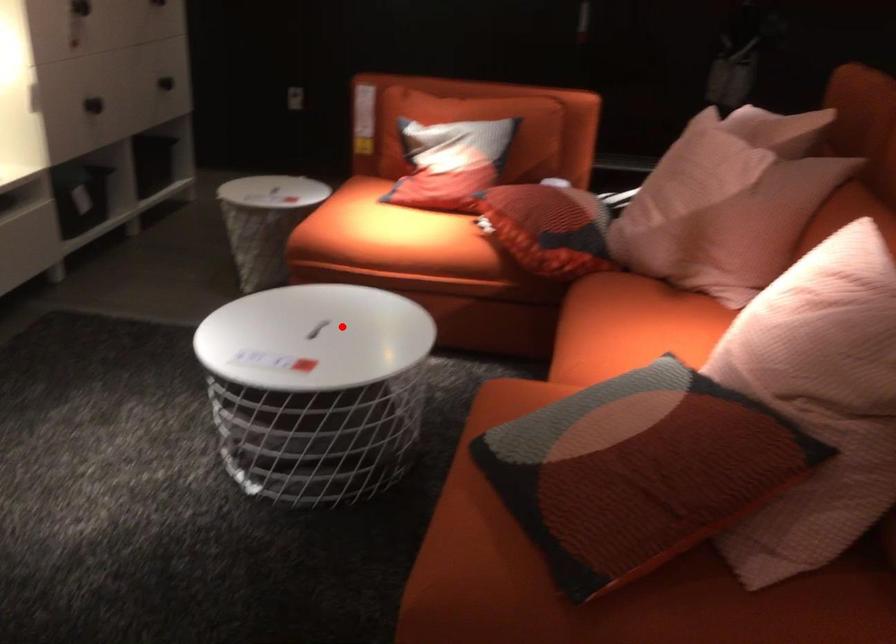
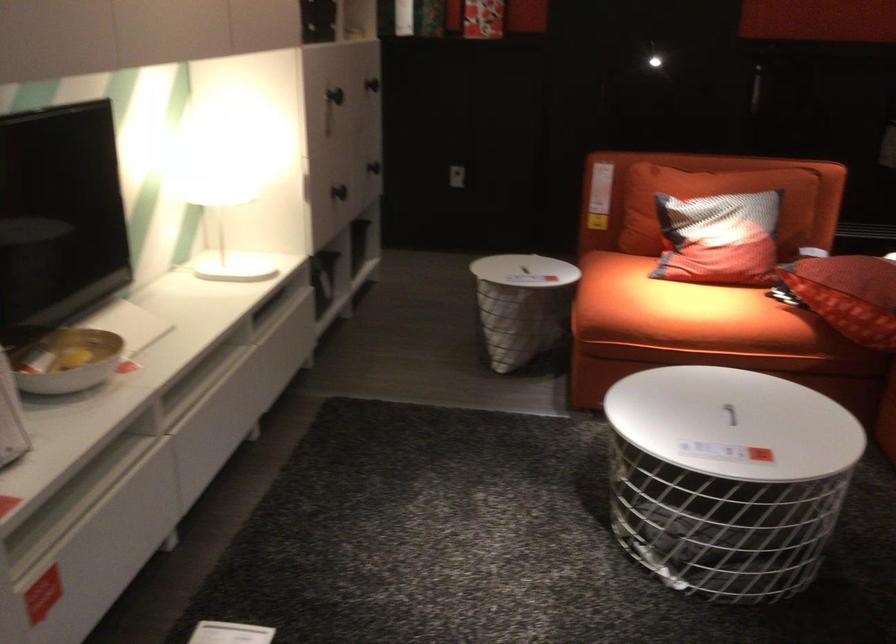
The point at the highlighted location is marked in the first image. Where is the corresponding point in the second image?

(729, 413)